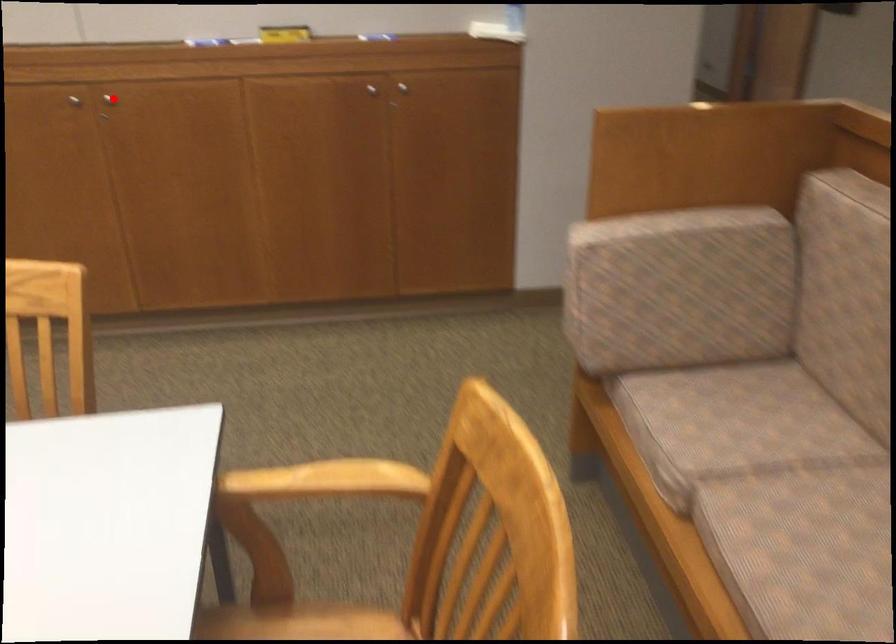
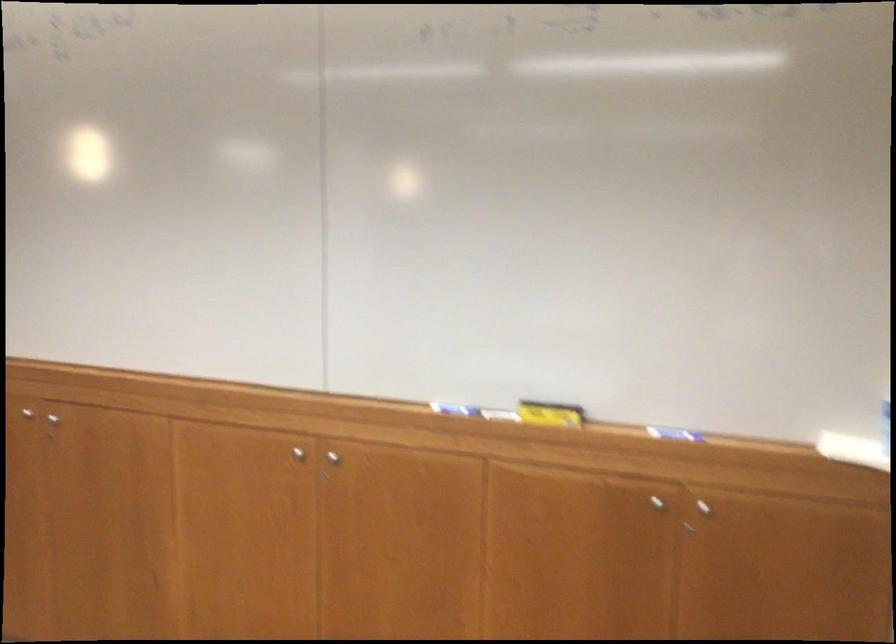
Question: I am providing you with two images of the same scene from different viewpoints. A red point is shown in image1. For the corresponding object point in image2, is it positioned nearer or farther from the camera?

Choices:
 (A) Nearer
 (B) Farther

Answer: (A)